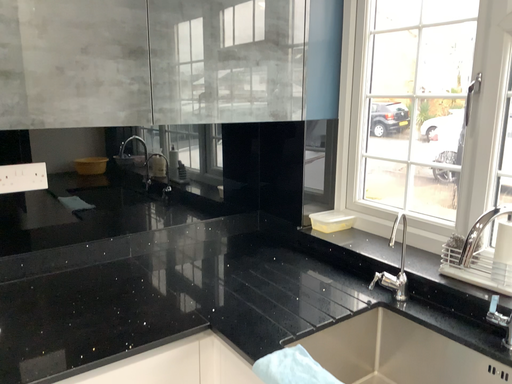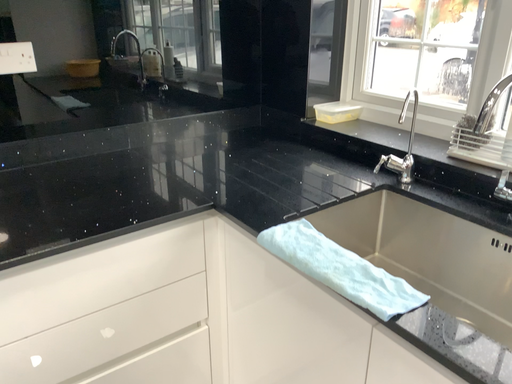
Question: How did the camera likely rotate when shooting the video?

Choices:
 (A) rotated upward
 (B) rotated downward

Answer: (B)